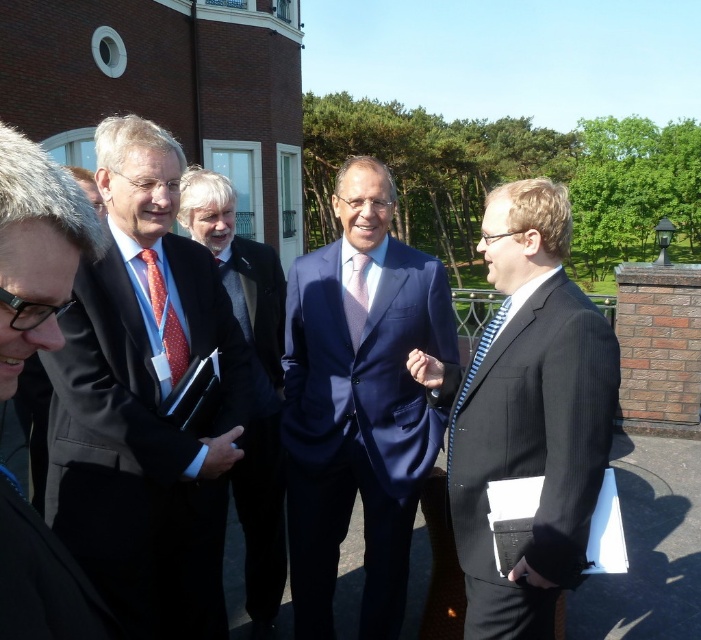
Locate an element on the screen. The height and width of the screenshot is (640, 701). matte black suit at left is located at coordinates (144, 401).

Is point (69, 323) positioned behind point (238, 275)?

No, it is in front of (238, 275).

Locate an element on the screen. matte black suit at left is located at coordinates (144, 401).

The image size is (701, 640). Describe the element at coordinates (355, 298) in the screenshot. I see `purple satin tie at center` at that location.

Between purple satin tie at center and matte red tie at center, which one has more height?

With more height is matte red tie at center.

Does point (348, 330) come behind point (240, 285)?

No, it is in front of (240, 285).

At what (x,y) coordinates should I click in order to perform the action: click on purple satin tie at center. Please return your answer as a coordinate pair (x, y). The image size is (701, 640). Looking at the image, I should click on (355, 298).

Does matte black suit at center come behind purple satin tie at center?

No, it is not.

Which is behind, point (74, 609) or point (348, 317)?

The point (348, 317) is more distant.

Locate an element on the screen. matte black suit at center is located at coordinates (36, 250).